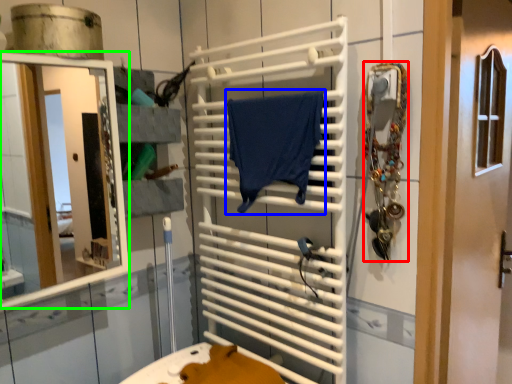
Question: Considering the real-world distances, which object is closest to accessory (highlighted by a red box)? bath towel (highlighted by a blue box) or mirror (highlighted by a green box).

Choices:
 (A) bath towel
 (B) mirror

Answer: (A)